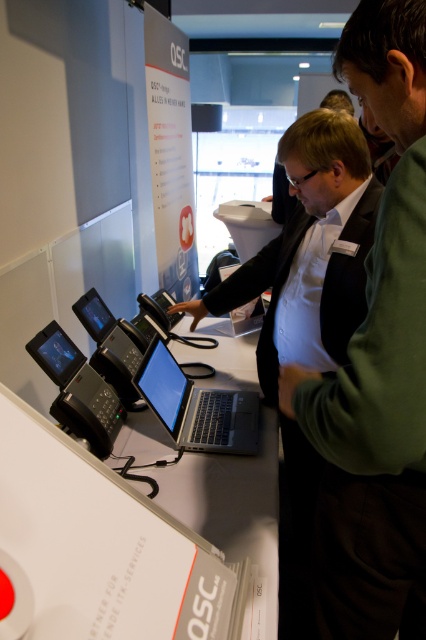
Question: Which point is closer to the camera?

Choices:
 (A) satin black laptop at center
 (B) green fabric shirt at center

Answer: (B)

Question: Where is green fabric shirt at center located in relation to satin black laptop at center in the image?

Choices:
 (A) below
 (B) above

Answer: (B)

Question: Which point is closer to the camera?

Choices:
 (A) green fabric shirt at center
 (B) satin black laptop at center

Answer: (A)

Question: Does green fabric shirt at center have a lesser width compared to satin black laptop at center?

Choices:
 (A) yes
 (B) no

Answer: (A)

Question: Does green fabric shirt at center have a greater width compared to satin black laptop at center?

Choices:
 (A) no
 (B) yes

Answer: (A)

Question: Which point appears farthest from the camera in this image?

Choices:
 (A) (256, 397)
 (B) (402, 365)

Answer: (A)